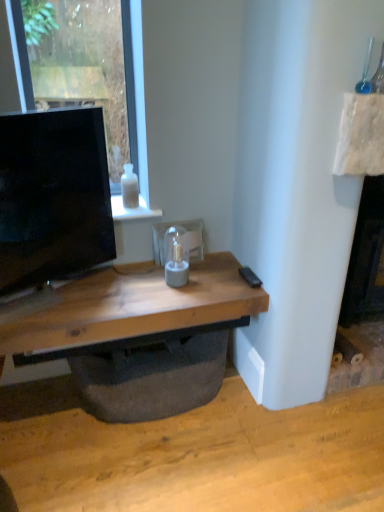
Identify the location of vacant space in front of transparent glass bottle at upper center. (131, 215).